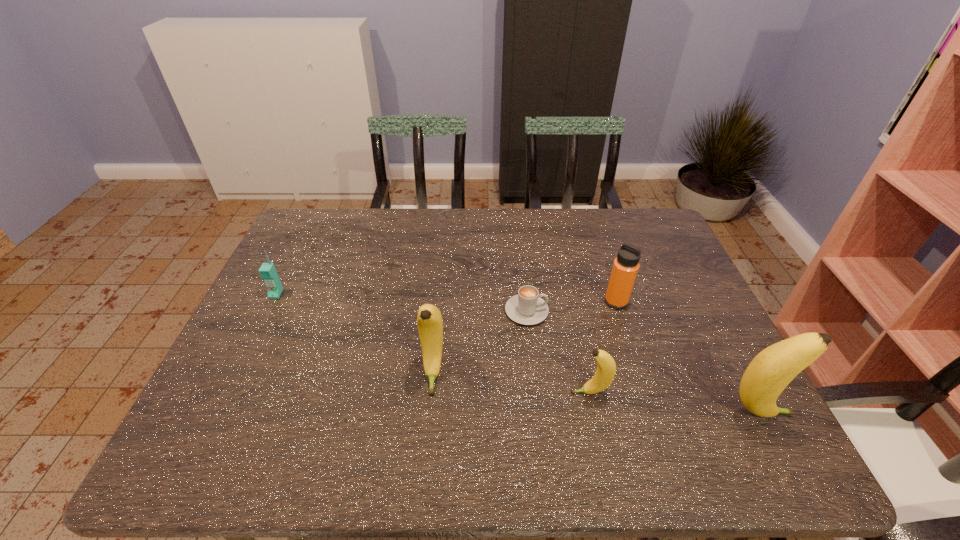
This screenshot has width=960, height=540. Find the location of `free space located from the stem of the second object from left to right`. free space located from the stem of the second object from left to right is located at coordinates (429, 416).

You are a GUI agent. You are given a task and a screenshot of the screen. Output one action in this format:
    pyautogui.click(x=<x>, y=<y>)
    Task: Click on the free region located 0.090m from the stem of the fourth object from left to right
    This screenshot has height=540, width=960.
    Given the screenshot: What is the action you would take?
    pyautogui.click(x=532, y=393)

Where is `vacant region located 0.290m from the stem of the fourth object from left to right`? vacant region located 0.290m from the stem of the fourth object from left to right is located at coordinates (445, 393).

Where is `vacant space situated from the stem of the fourth object from left to right`? The width and height of the screenshot is (960, 540). vacant space situated from the stem of the fourth object from left to right is located at coordinates (415, 393).

Locate an element on the screen. vacant space situated 0.370m on the keypad of the cellular telephone is located at coordinates (215, 418).

Identify the location of vacant space located on the back of the fifth object from left to right. (606, 268).

Find the location of a particular element. free space located 0.390m to the right of the fourth object from right to left is located at coordinates (690, 311).

Identify the location of object present at the left edge. (268, 273).

Locate an element on the screen. This screenshot has height=540, width=960. object that is at the right edge is located at coordinates (769, 373).

Where is `object positioned at the near right corner`? The height and width of the screenshot is (540, 960). object positioned at the near right corner is located at coordinates (769, 373).